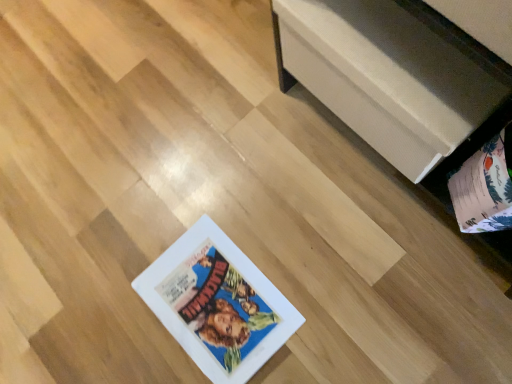
Identify the location of vacant area on top of white matte storage chest at upper right (from a real-world perspective). This screenshot has width=512, height=384. (397, 39).